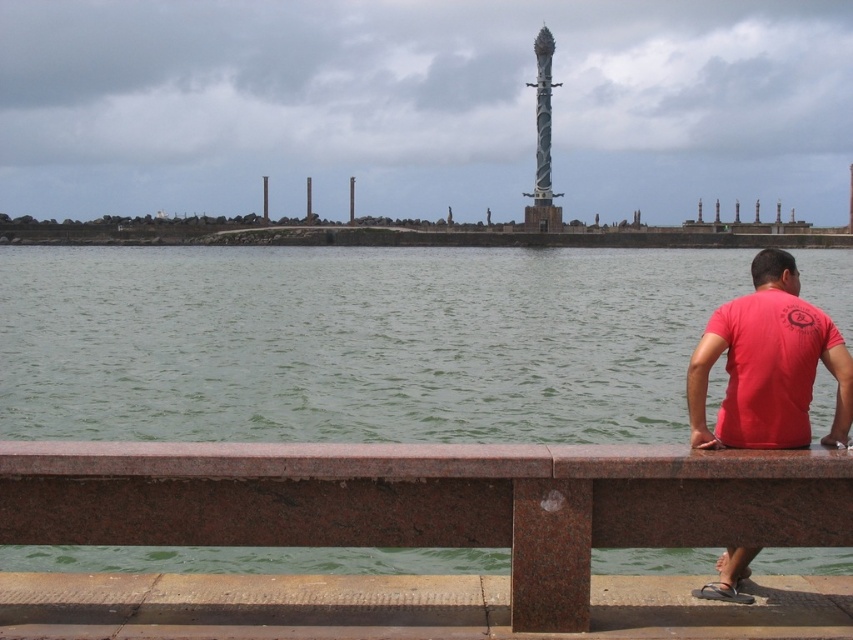
Question: Based on their relative distances, which object is nearer to the spiral metal pole at center?

Choices:
 (A) green water at lower center
 (B) brown polished stone dock at lower center
 (C) brown granite rail at lower center
 (D) red matte shirt at lower right

Answer: (A)

Question: Which of these objects is positioned farthest from the spiral metal pole at center?

Choices:
 (A) green water at lower center
 (B) brown polished stone dock at lower center
 (C) red matte shirt at lower right
 (D) brown granite rail at lower center

Answer: (B)

Question: Considering the relative positions of red matte shirt at lower right and spiral metal pole at center in the image provided, where is red matte shirt at lower right located with respect to spiral metal pole at center?

Choices:
 (A) below
 (B) above

Answer: (A)

Question: Does red matte shirt at lower right appear on the left side of spiral metal pole at center?

Choices:
 (A) yes
 (B) no

Answer: (A)

Question: Does red matte shirt at lower right have a lesser width compared to spiral metal pole at center?

Choices:
 (A) yes
 (B) no

Answer: (A)

Question: Considering the real-world distances, which object is farthest from the green water at lower center?

Choices:
 (A) red matte shirt at lower right
 (B) brown granite rail at lower center
 (C) spiral metal pole at center

Answer: (A)